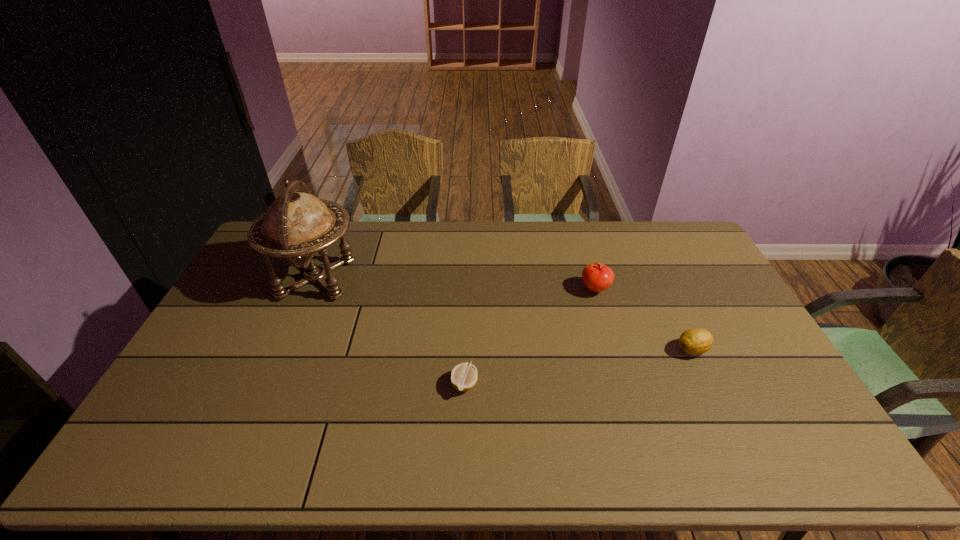
Where is `vacant space at the left edge of the desktop`? vacant space at the left edge of the desktop is located at coordinates (238, 319).

You are a GUI agent. You are given a task and a screenshot of the screen. Output one action in this format:
    pyautogui.click(x=<x>, y=<y>)
    Task: Click on the vacant space at the right edge of the desktop
    
    Given the screenshot: What is the action you would take?
    pyautogui.click(x=739, y=308)

Where is `vacant area at the near left corner`? The width and height of the screenshot is (960, 540). vacant area at the near left corner is located at coordinates click(139, 454).

Where is `free area in between the third farthest object and the tallest object`? This screenshot has width=960, height=540. free area in between the third farthest object and the tallest object is located at coordinates [x=504, y=314].

Where is `vacant area that lies between the second shortest object and the shorter lemon`? The image size is (960, 540). vacant area that lies between the second shortest object and the shorter lemon is located at coordinates (579, 367).

Where is `empty location between the tallest object and the apple`? The height and width of the screenshot is (540, 960). empty location between the tallest object and the apple is located at coordinates (456, 284).

This screenshot has height=540, width=960. Identify the location of vacant area between the globe and the nearer lemon. (391, 331).

Where is `vacant area between the third tallest object and the shortest object`? vacant area between the third tallest object and the shortest object is located at coordinates (579, 367).

The height and width of the screenshot is (540, 960). Find the location of `free spot between the rightmost object and the leftmost object`. free spot between the rightmost object and the leftmost object is located at coordinates (504, 314).

Identify the location of vacant region between the apple and the right lemon. The image size is (960, 540). (644, 319).